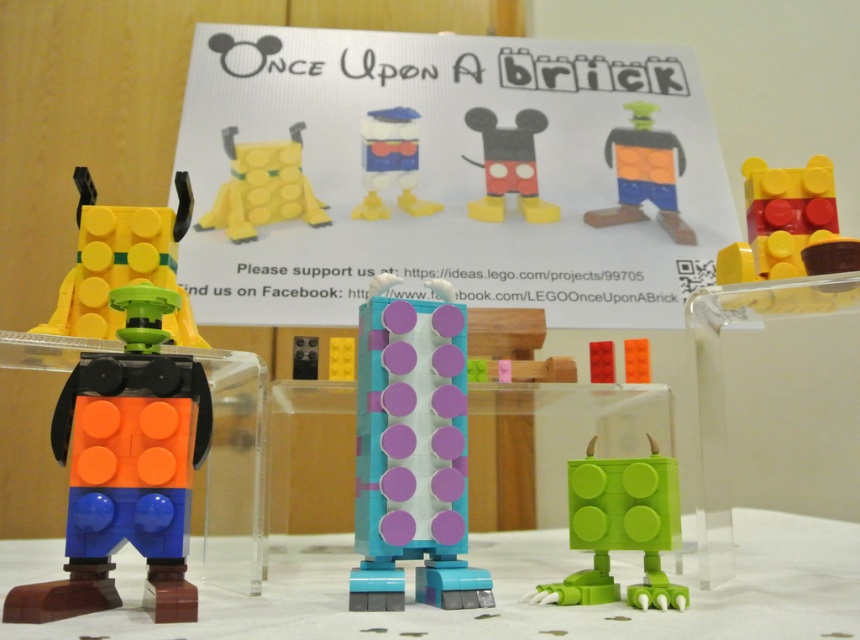
You are standing in front of a LEGO display featuring three Disney characters. You see the Goofy figure on the left, the Minnie Mouse figure in the center, and the Pluto figure at the rightmost position. Which of these figures is positioned at the coordinate point (619, 529)?

The green matte toy at lower right is located at point (619, 529), so the Pluto figure at the rightmost position is positioned there.

You are a child trying to reach for the green matte toy at lower right and the orange matte block man at center on a shelf. Which one can you grab first without moving your hand?

The green matte toy at lower right is closer to the viewer than the orange matte block man at center, so you can grab the green matte toy at lower right first without moving your hand.